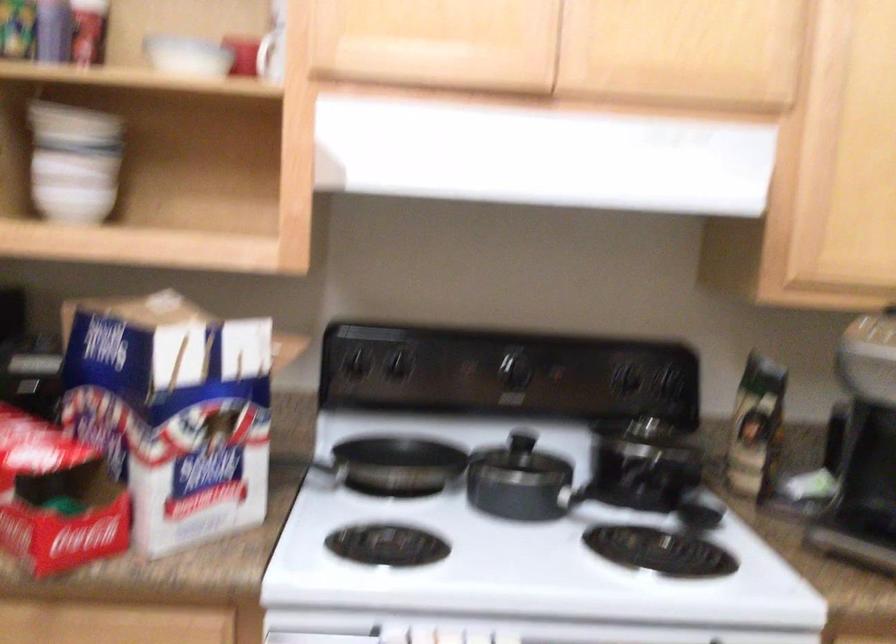
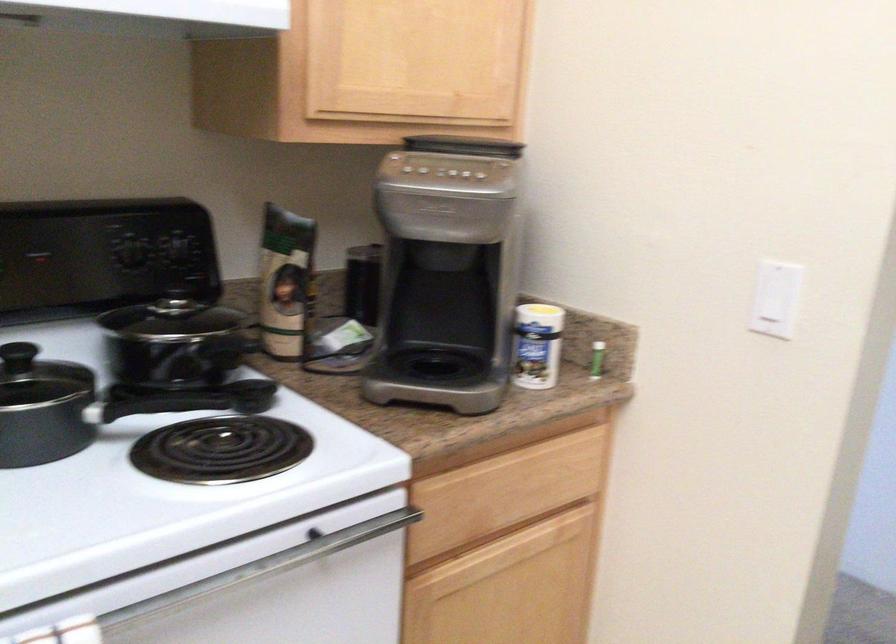
Locate, in the second image, the point that corresponds to [622,375] in the first image.

(130, 247)